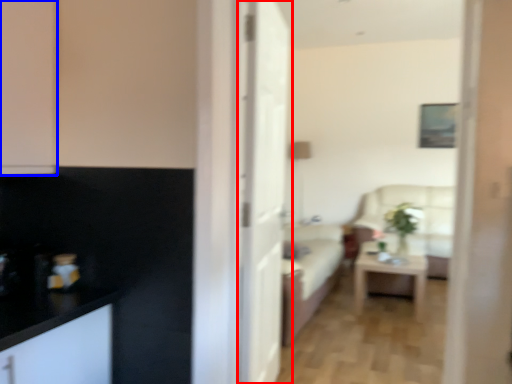
Question: Which of the following is the closest to the observer, door (highlighted by a red box) or cabinetry (highlighted by a blue box)?

Choices:
 (A) door
 (B) cabinetry

Answer: (B)